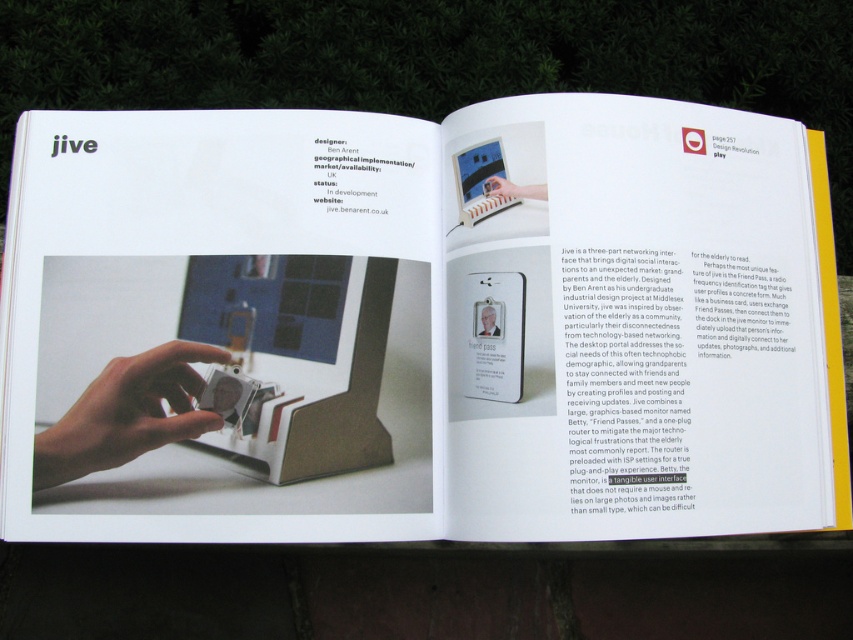
Can you confirm if white plastic device at center is thinner than matte plastic hand at center?

No.

Who is higher up, white plastic device at center or matte plastic hand at center?

Positioned higher is matte plastic hand at center.

Locate an element on the screen. The image size is (853, 640). white plastic device at center is located at coordinates (434, 321).

Is point (154, 349) in front of point (498, 179)?

Yes, point (154, 349) is closer to viewer.

Locate an element on the screen. smooth plastic hand at center is located at coordinates (126, 413).

Describe the element at coordinates (434, 321) in the screenshot. I see `white plastic device at center` at that location.

Is the position of white plastic device at center less distant than that of silver metallic badge at center?

Yes, it is.

Between point (351, 115) and point (496, 330), which one is positioned behind?

The point (351, 115) is behind.

Where is `white plastic device at center`? The width and height of the screenshot is (853, 640). white plastic device at center is located at coordinates (434, 321).